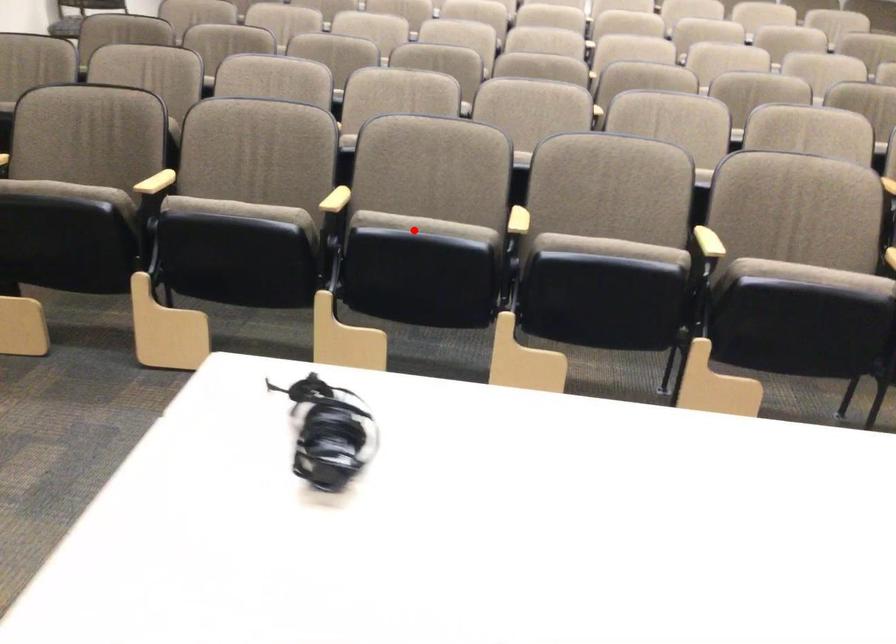
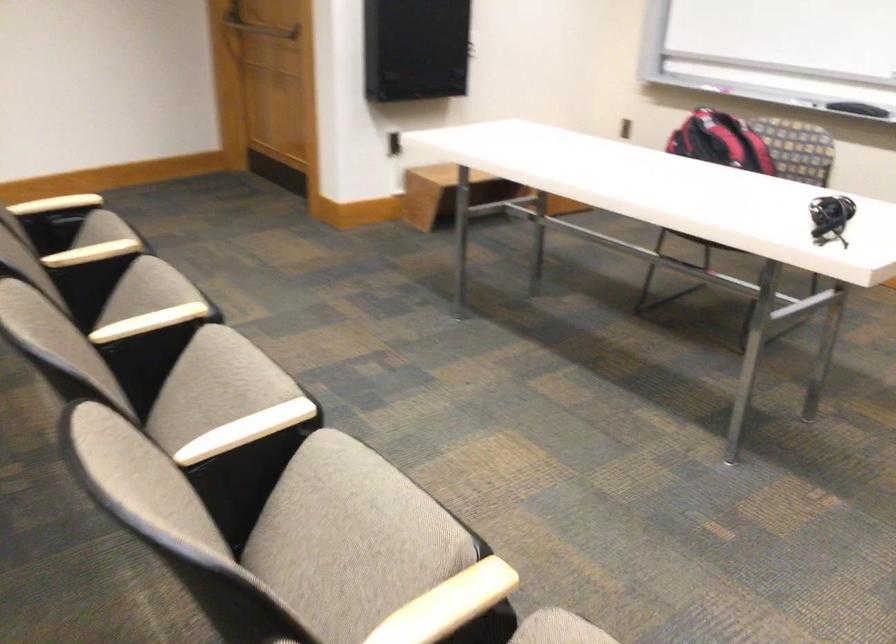
The point at the highlighted location is marked in the first image. Where is the corresponding point in the second image?

(352, 531)